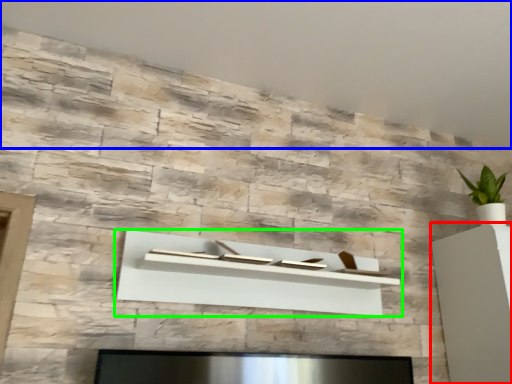
Question: Considering the real-world distances, which object is farthest from furniture (highlighted by a red box)? backdrop (highlighted by a blue box) or shelf (highlighted by a green box)?

Choices:
 (A) backdrop
 (B) shelf

Answer: (A)